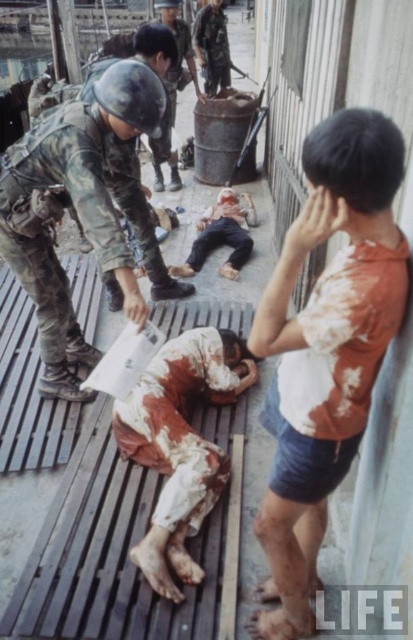
Based on the scene described, which object is positioned lower in the image between the camouflage uniform at center and the camouflage fabric uniform at center?

The camouflage uniform at center is located below the camouflage fabric uniform at center, so it is positioned lower in the image.

You are a medic trying to reach the casualties. You see the dirty orange shirt at right and the camouflage fabric soldier at center. Which casualty is closer to the right edge of the platform?

The dirty orange shirt at right is to the right of the camouflage fabric soldier at center, so the dirty orange shirt at right is closer to the right edge of the platform.